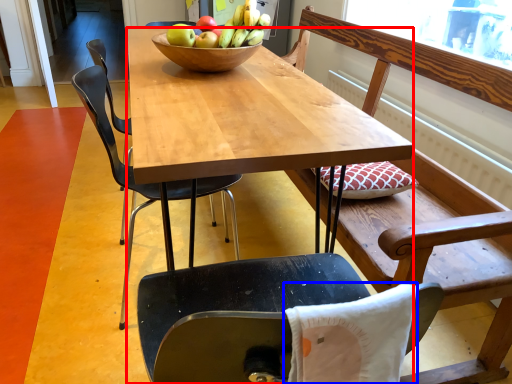
Question: Which point is closer to the camera, desk (highlighted by a red box) or pillow (highlighted by a blue box)?

Choices:
 (A) desk
 (B) pillow

Answer: (B)